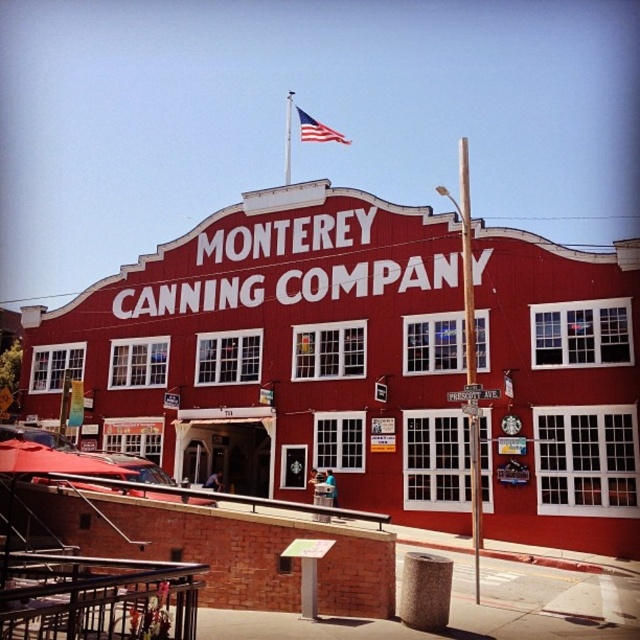
Who is more forward, (300, 124) or (468, 392)?

Positioned in front is point (468, 392).

Who is shorter, american flag at upper center or white wooden street sign at center?

white wooden street sign at center is shorter.

Is point (326, 129) in front of point (449, 392)?

No, it is behind (449, 392).

Where is `american flag at upper center`? This screenshot has width=640, height=640. american flag at upper center is located at coordinates (316, 129).